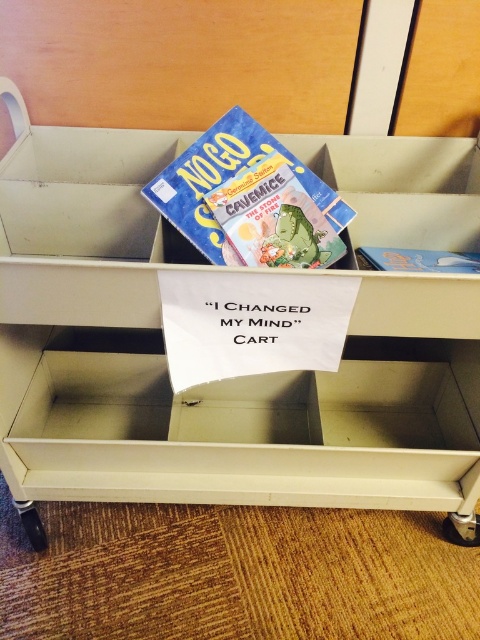
You are a librarian organizing the I CHANGED MY MIND CART. You need to place a new book on the shelf above the metallic silver wheel at lower right. Can you reach it without moving the matte cardboard drawer at upper center?

The matte cardboard drawer at upper center is to the left of the metallic silver wheel at lower right. Since the drawer is not blocking the path to the wheel, you can reach the shelf above the metallic silver wheel at lower right without moving the matte cardboard drawer at upper center.

You are a librarian organizing items on the I CHANGED MY MIND CART. You need to place a new item that requires more space. Which object on the cart would be better to use for this purpose, the matte cardboard drawer at upper center or the metallic silver wheel at lower right?

The matte cardboard drawer at upper center is larger in size than the metallic silver wheel at lower right, so it would be better to use the matte cardboard drawer at upper center for placing the new item that requires more space.